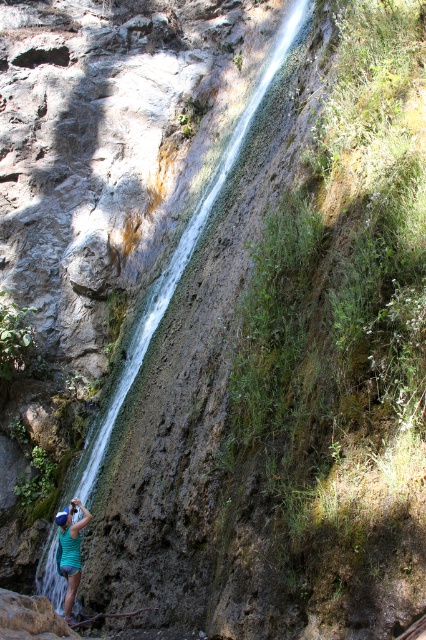
How far apart are clear water at center and green fabric shirt at lower left?

clear water at center and green fabric shirt at lower left are 7.24 meters apart.

Which of these two, clear water at center or green fabric shirt at lower left, stands shorter?

green fabric shirt at lower left

Find the location of a particular element. The width and height of the screenshot is (426, 640). clear water at center is located at coordinates (183, 253).